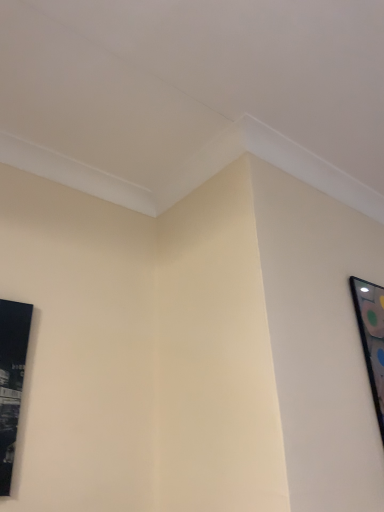
This screenshot has width=384, height=512. In order to click on metallic glossy picture frame at right in this screenshot , I will do `click(371, 337)`.

What is the approximate width of metallic glossy picture frame at right?

It is 1.84 inches.

Image resolution: width=384 pixels, height=512 pixels. What do you see at coordinates (371, 337) in the screenshot? I see `metallic glossy picture frame at right` at bounding box center [371, 337].

Measure the distance between point (361,332) and camera.

Point (361,332) and camera are 5.45 feet apart.

Image resolution: width=384 pixels, height=512 pixels. I want to click on metallic glossy picture frame at right, so click(371, 337).